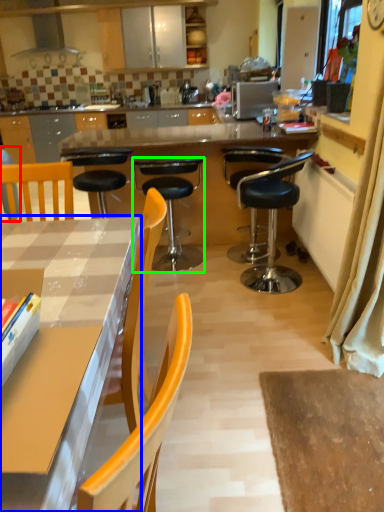
Question: Estimate the real-world distances between objects in this image. Which object is closer to armchair (highlighted by a red box), countertop (highlighted by a blue box) or chair (highlighted by a green box)?

Choices:
 (A) countertop
 (B) chair

Answer: (B)